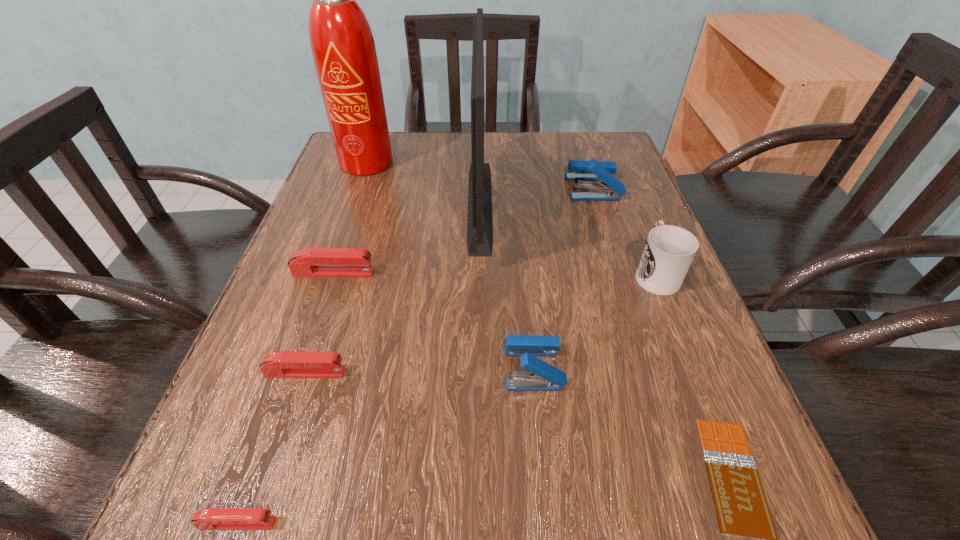
At what (x,y) coordinates should I click in order to perform the action: click on cup at the right edge. Please return your answer as a coordinate pair (x, y). Image resolution: width=960 pixels, height=540 pixels. Looking at the image, I should click on (669, 250).

Locate an element on the screen. This screenshot has width=960, height=540. stapler that is at the right edge is located at coordinates (592, 170).

Where is `object that is at the far left corner`? This screenshot has width=960, height=540. object that is at the far left corner is located at coordinates (342, 44).

This screenshot has height=540, width=960. In order to click on object present at the near left corner in this screenshot , I will do `click(213, 518)`.

Locate an element on the screen. object that is at the far right corner is located at coordinates (592, 170).

I want to click on free location at the far edge, so click(x=491, y=165).

Identify the location of free space at the near edge of the desktop. The width and height of the screenshot is (960, 540). (380, 483).

In the image, there is a desktop. What are the coordinates of `vacant space at the left edge` in the screenshot? It's located at tap(253, 382).

Find the location of a particular element. The width and height of the screenshot is (960, 540). vacant space at the far left corner of the desktop is located at coordinates (394, 142).

Locate an element on the screen. vacant area at the near left corner is located at coordinates (221, 480).